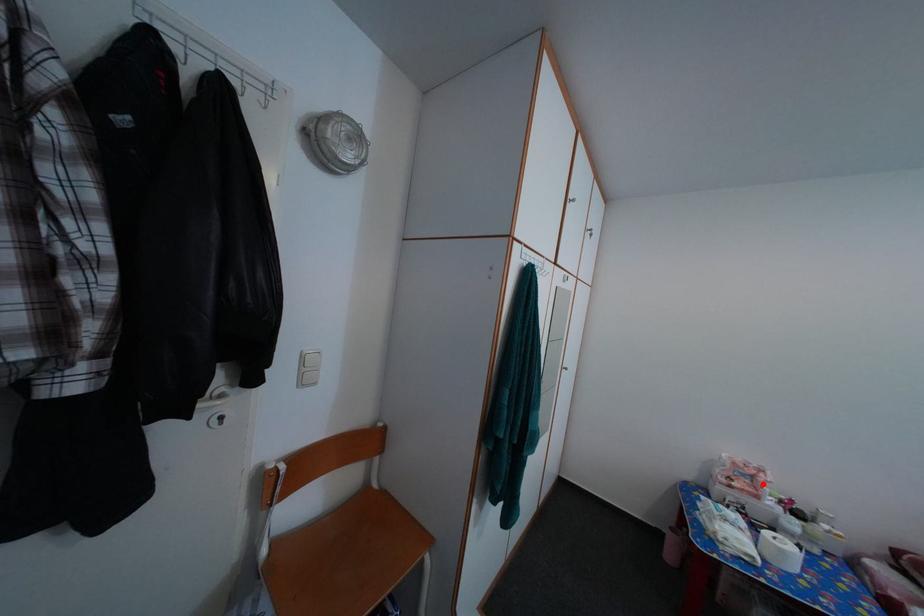
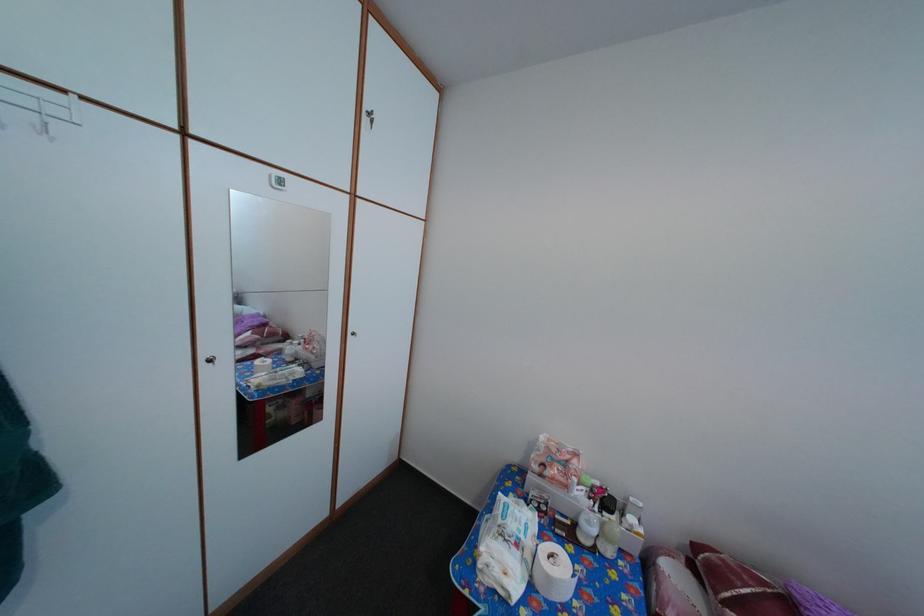
Question: I am providing you with two images of the same scene from different viewpoints. A red point is marked on the first image. At the location where the point appears in image 1, is it still visible in image 2?

Choices:
 (A) Yes
 (B) No

Answer: (A)